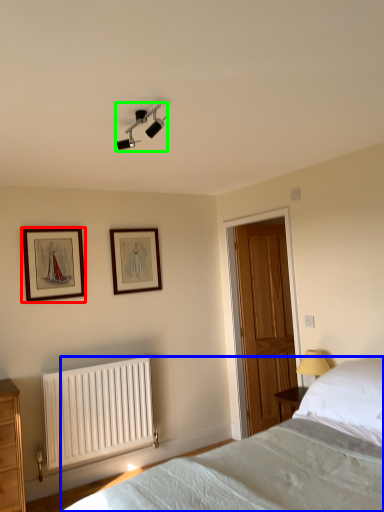
Question: Considering the real-world distances, which object is farthest from picture frame (highlighted by a red box)? bed (highlighted by a blue box) or light fixture (highlighted by a green box)?

Choices:
 (A) bed
 (B) light fixture

Answer: (A)